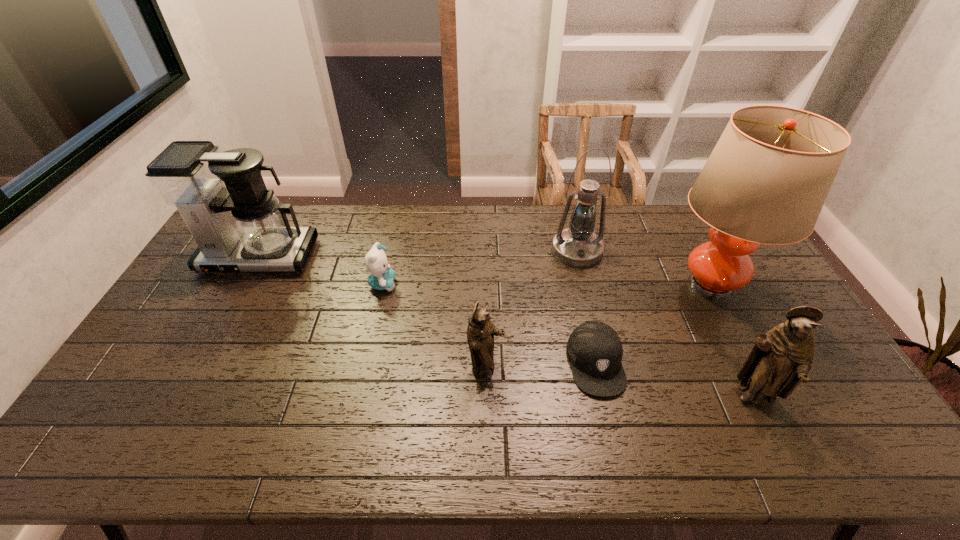
Find the location of a particular element. the fifth tallest object is located at coordinates (480, 332).

Where is `the third object from left to right`? Image resolution: width=960 pixels, height=540 pixels. the third object from left to right is located at coordinates (480, 332).

Image resolution: width=960 pixels, height=540 pixels. What are the coordinates of `the right figurine` in the screenshot? It's located at (781, 359).

Where is `the taller figurine`? the taller figurine is located at coordinates (781, 359).

I want to click on the second object from left to right, so click(x=381, y=277).

Find the location of a particular element. The image size is (960, 540). the sixth tallest object is located at coordinates (381, 277).

Locate an element on the screen. oil lamp is located at coordinates (577, 246).

At what (x,y) coordinates should I click in order to perform the action: click on the leftmost object. Please return your answer as a coordinate pair (x, y). This screenshot has height=540, width=960. Looking at the image, I should click on click(x=242, y=227).

Locate an element on the screen. This screenshot has height=540, width=960. lamp is located at coordinates (766, 181).

I want to click on cap, so click(x=595, y=351).